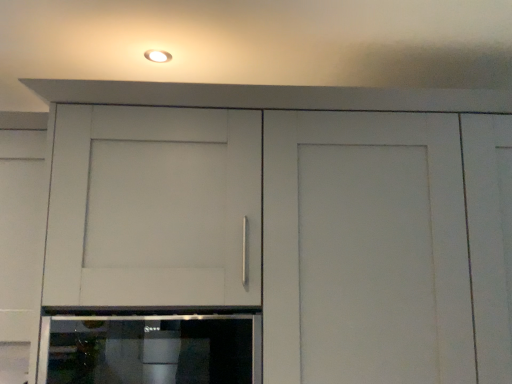
Question: Is sleek stainless steel oven at lower center inside or outside of matte white light fixture at upper center?

Choices:
 (A) outside
 (B) inside

Answer: (A)

Question: From the image's perspective, relative to matte white light fixture at upper center, is sleek stainless steel oven at lower center above or below?

Choices:
 (A) below
 (B) above

Answer: (A)

Question: Looking at their shapes, would you say sleek stainless steel oven at lower center is wider or thinner than matte white light fixture at upper center?

Choices:
 (A) wide
 (B) thin

Answer: (A)

Question: Is matte white light fixture at upper center wider or thinner than sleek stainless steel oven at lower center?

Choices:
 (A) thin
 (B) wide

Answer: (A)

Question: Considering the positions of matte white light fixture at upper center and sleek stainless steel oven at lower center in the image, is matte white light fixture at upper center taller or shorter than sleek stainless steel oven at lower center?

Choices:
 (A) tall
 (B) short

Answer: (B)

Question: Is matte white light fixture at upper center bigger or smaller than sleek stainless steel oven at lower center?

Choices:
 (A) small
 (B) big

Answer: (A)

Question: From a real-world perspective, is matte white light fixture at upper center physically located above or below sleek stainless steel oven at lower center?

Choices:
 (A) above
 (B) below

Answer: (A)